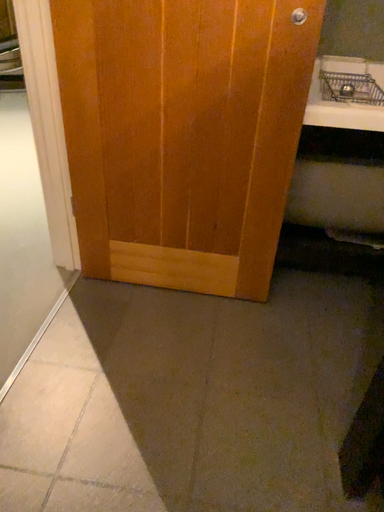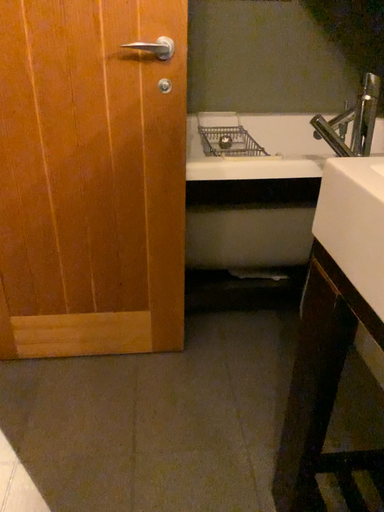
Question: How did the camera likely rotate when shooting the video?

Choices:
 (A) rotated downward
 (B) rotated upward

Answer: (B)